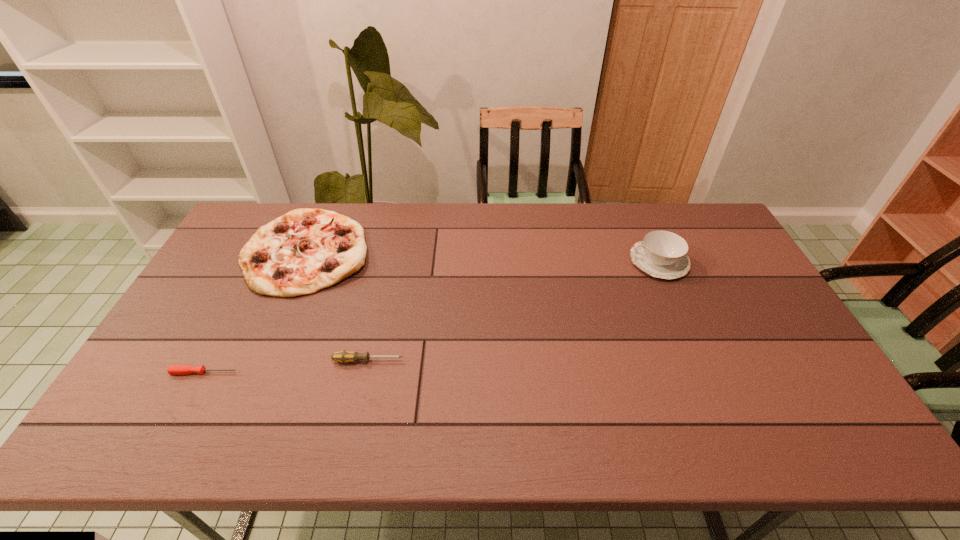
I want to click on vacant space at the left edge of the desktop, so click(x=177, y=326).

At what (x,y) coordinates should I click in order to perform the action: click on vacant region at the right edge of the desktop. Please return your answer as a coordinate pair (x, y). This screenshot has width=960, height=540. Looking at the image, I should click on (721, 307).

You are a GUI agent. You are given a task and a screenshot of the screen. Output one action in this format:
    pyautogui.click(x=<x>, y=<y>)
    Task: Click on the free space at the far right corner
    The width and height of the screenshot is (960, 540).
    Given the screenshot: What is the action you would take?
    pyautogui.click(x=691, y=207)

At what (x,y) coordinates should I click in order to perform the action: click on vacant area that lies between the tallest object and the farther screwdriver. Please return your answer as a coordinate pair (x, y). The width and height of the screenshot is (960, 540). Looking at the image, I should click on (514, 311).

This screenshot has height=540, width=960. What are the coordinates of `blank region between the third shortest object and the shorter screwdriver` in the screenshot? It's located at (255, 312).

I want to click on empty location between the nearest object and the chinaware, so click(432, 317).

Identify the location of empty location between the second tallest object and the right screwdriver. The width and height of the screenshot is (960, 540). (337, 306).

I want to click on vacant region between the tallest object and the pizza, so click(483, 256).

You are a GUI agent. You are given a task and a screenshot of the screen. Output one action in this format:
    pyautogui.click(x=<x>, y=<y>)
    Task: Click on the empty space that is in between the pizza and the shorter screwdriver
    The image size is (960, 540).
    Given the screenshot: What is the action you would take?
    pyautogui.click(x=255, y=312)

Identify the location of free spot between the nearer screwdriver and the tallest object. (432, 317).